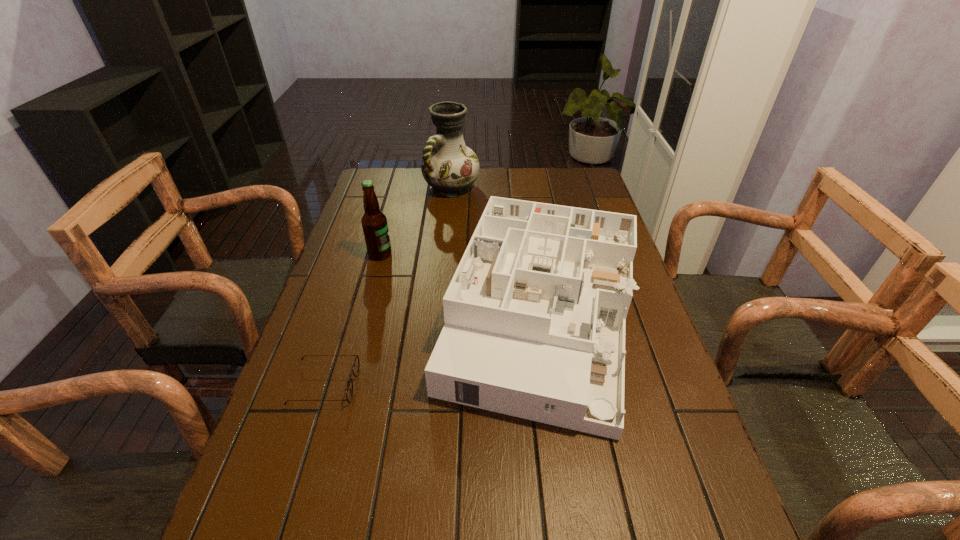
Find the location of `the farthest object`. the farthest object is located at coordinates (450, 167).

Where is `the tallest object`? the tallest object is located at coordinates (450, 167).

Locate an element on the screen. The image size is (960, 540). the second tallest object is located at coordinates (374, 222).

Where is `dollhouse`? The image size is (960, 540). dollhouse is located at coordinates click(x=535, y=314).

Where is `sunglasses`? The image size is (960, 540). sunglasses is located at coordinates (349, 393).

Image resolution: width=960 pixels, height=540 pixels. Identify the location of free region located 0.050m on the back of the vase. (453, 167).

Image resolution: width=960 pixels, height=540 pixels. In order to click on vacant space located on the label of the beer bottle in this screenshot , I will do `click(454, 254)`.

I want to click on vacant space situated on the back of the dollhouse, so click(x=523, y=198).

Locate an element on the screen. Image resolution: width=960 pixels, height=540 pixels. free point located on the front-facing side of the sunglasses is located at coordinates (444, 385).

I want to click on object that is positioned at the far edge, so click(450, 167).